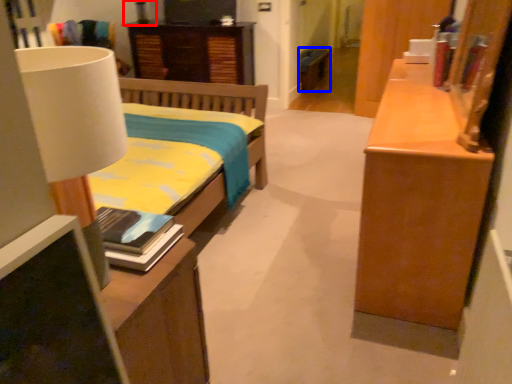
Question: Which object appears closest to the camera in this image, lamp (highlighted by a red box) or cabinetry (highlighted by a blue box)?

Choices:
 (A) lamp
 (B) cabinetry

Answer: (A)